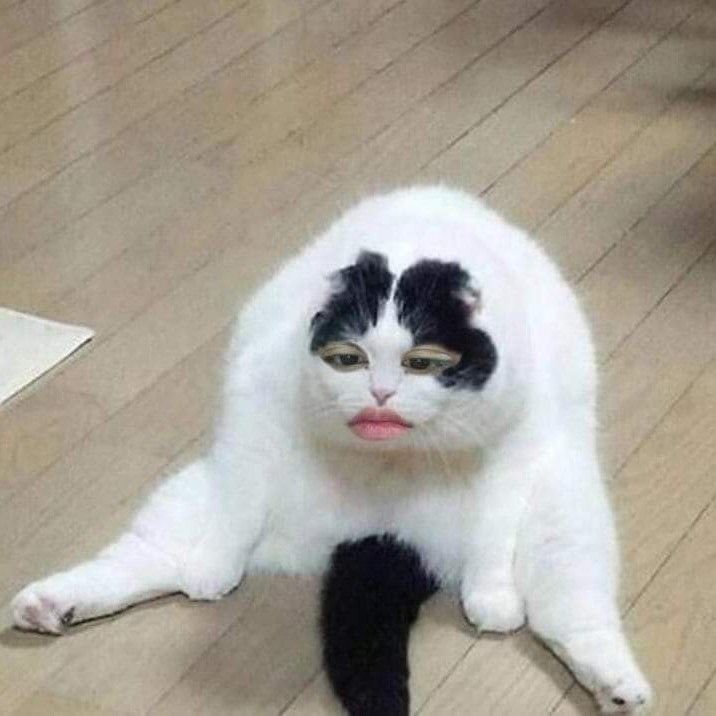
You are a GUI agent. You are given a task and a screenshot of the screen. Output one action in this format:
    pyautogui.click(x=<x>, y=<y>)
    Task: Click on the corner of area rug
    The width and height of the screenshot is (716, 716).
    Given the screenshot: What is the action you would take?
    pyautogui.click(x=59, y=334)